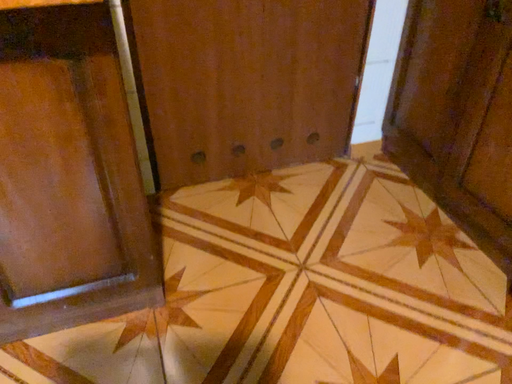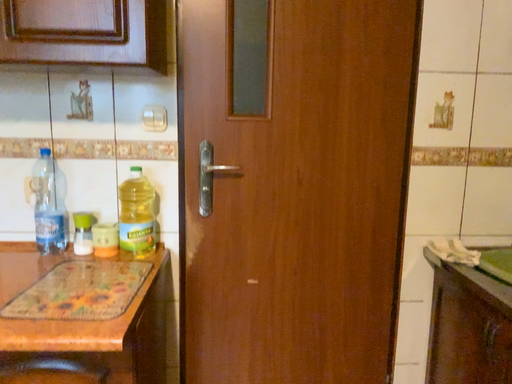
Question: Which way did the camera rotate in the video?

Choices:
 (A) rotated upward
 (B) rotated downward

Answer: (A)